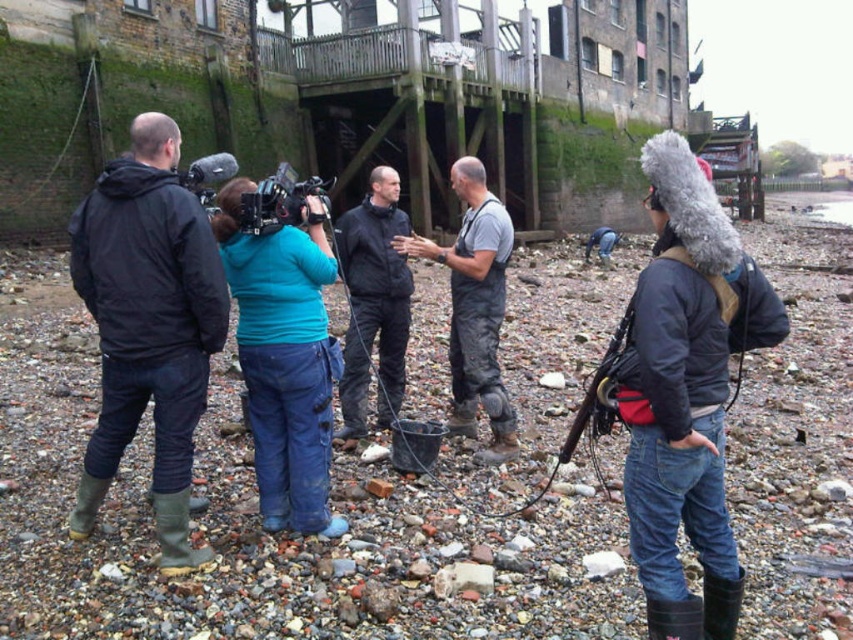
You are a costume designer preparing for a scene where two jackets need to be placed on a rack. The dark gray jacket at center and the teal fabric jacket at center must be arranged based on their height. Which jacket should you place on the lower rack to ensure proper visibility of both?

The dark gray jacket at center is shorter than the teal fabric jacket at center, so placing the dark gray jacket at center on the lower rack will allow the taller teal fabric jacket at center to be seen above it.